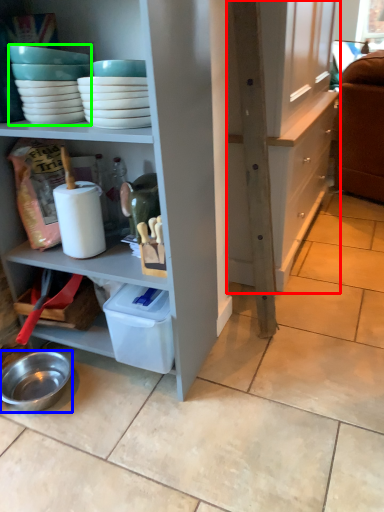
Question: Which is nearer to the cabinetry (highlighted by a red box)? bowl (highlighted by a blue box) or tableware (highlighted by a green box).

Choices:
 (A) bowl
 (B) tableware

Answer: (B)